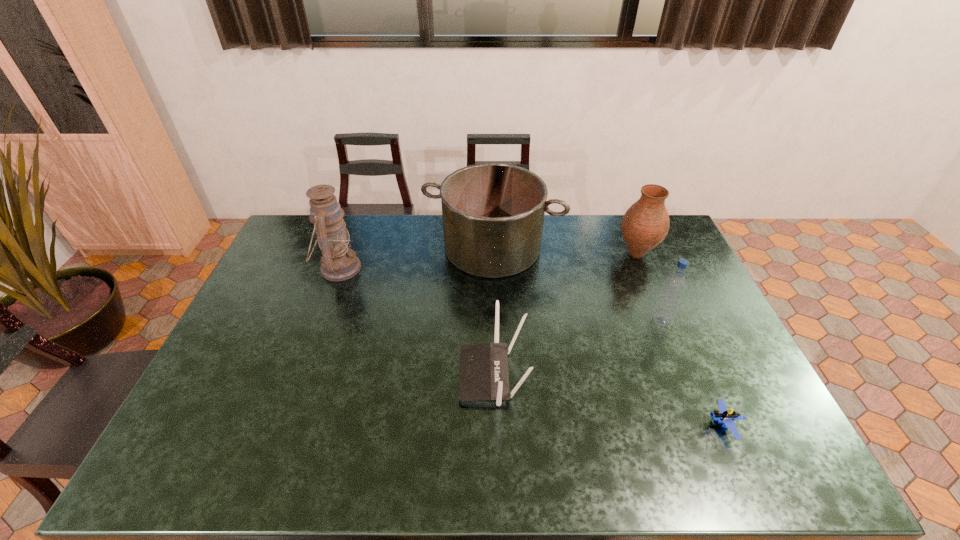
The height and width of the screenshot is (540, 960). What are the coordinates of `vacant space located on the front of the water bottle` in the screenshot? It's located at (684, 379).

Locate an element on the screen. The image size is (960, 540). blank space located 0.380m on the front-facing side of the fifth tallest object is located at coordinates (320, 375).

Identify the location of free space located on the front-facing side of the fifth tallest object. (426, 375).

Identify the location of free space located on the front-facing side of the fifth tallest object. The image size is (960, 540). (338, 375).

The height and width of the screenshot is (540, 960). In order to click on vacant space situated 0.160m on the front-facing side of the Lego in this screenshot , I will do `click(641, 425)`.

Find the location of `vacant area situated on the front-facing side of the Lego`. vacant area situated on the front-facing side of the Lego is located at coordinates (596, 425).

The width and height of the screenshot is (960, 540). What are the coordinates of `blank area located on the front-facing side of the Lego` in the screenshot? It's located at (685, 425).

In order to click on oil lamp present at the far edge in this screenshot , I will do `click(338, 262)`.

You are a GUI agent. You are given a task and a screenshot of the screen. Output one action in this format:
    pyautogui.click(x=<x>, y=<y>)
    Task: Click on the vase that is at the far edge
    This screenshot has height=540, width=960.
    Given the screenshot: What is the action you would take?
    pyautogui.click(x=646, y=223)

This screenshot has height=540, width=960. In order to click on pan at the far edge in this screenshot , I will do `click(493, 213)`.